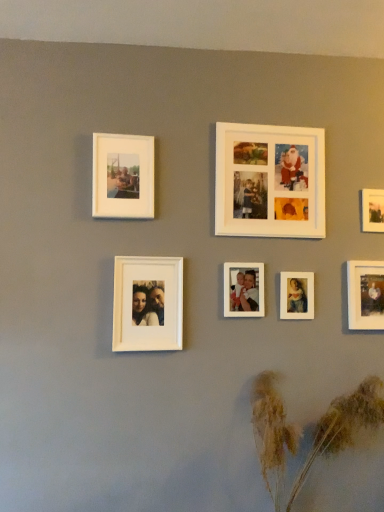
What do you see at coordinates (373, 210) in the screenshot? The image size is (384, 512). I see `matte white photo frame at upper right, marked as the seventh picture frame in a left-to-right arrangement` at bounding box center [373, 210].

What do you see at coordinates (365, 295) in the screenshot? The image size is (384, 512). I see `matte white photo frame at lower right, the 6th picture frame from the left` at bounding box center [365, 295].

Locate an element on the screen. white matte photo frame at center, arranged as the 3th picture frame when viewed from the left is located at coordinates pyautogui.click(x=244, y=290).

How much space does white matte photo frame at upper center, arranged as the fourth picture frame when viewed from the left, occupy horizontally?

white matte photo frame at upper center, arranged as the fourth picture frame when viewed from the left, is 2.12 inches in width.

What is the approximate height of white matte photo frame at upper center, arranged as the fourth picture frame when viewed from the left?

The height of white matte photo frame at upper center, arranged as the fourth picture frame when viewed from the left, is 18.93 inches.

In order to face white matte photo frame at upper left, which ranks as the 7th picture frame in right-to-left order, should I rotate leftwards or rightwards?

Turn left approximately 9.119 degrees to face it.

Image resolution: width=384 pixels, height=512 pixels. What do you see at coordinates (296, 295) in the screenshot?
I see `matte white photo frame at center right, the third picture frame viewed from the right` at bounding box center [296, 295].

This screenshot has width=384, height=512. Identify the location of brown textured plant at lower right. (344, 424).

Identify the location of matte white photo frame at upper right, marked as the seventh picture frame in a left-to-right arrangement. (373, 210).

From the image's perspective, relative to brown textured plant at lower right, is matte white photo frame at lower right, the 6th picture frame from the left, above or below?

Based on their image positions, matte white photo frame at lower right, the 6th picture frame from the left, is located above brown textured plant at lower right.

Considering the points (369, 325) and (269, 419), which point is in front, point (369, 325) or point (269, 419)?

The point (269, 419) is closer to the camera.

Between matte white photo frame at lower right, the 6th picture frame from the left, and brown textured plant at lower right, which one has larger size?

brown textured plant at lower right is bigger.

Is matte white photo frame at lower right, positioned as the second picture frame in right-to-left order, positioned far away from brown textured plant at lower right?

That's not correct — matte white photo frame at lower right, positioned as the second picture frame in right-to-left order, is a little close to brown textured plant at lower right.

How distant is white matte photo frame at center, the sixth picture frame from the right, from matte white photo frame at upper right, marked as the seventh picture frame in a left-to-right arrangement?

white matte photo frame at center, the sixth picture frame from the right, and matte white photo frame at upper right, marked as the seventh picture frame in a left-to-right arrangement, are 35.89 inches apart.

Considering the relative sizes of white matte photo frame at center, the sixth picture frame from the right, and matte white photo frame at upper right, marked as the seventh picture frame in a left-to-right arrangement, in the image provided, is white matte photo frame at center, the sixth picture frame from the right, bigger than matte white photo frame at upper right, marked as the seventh picture frame in a left-to-right arrangement,?

Yes, white matte photo frame at center, the sixth picture frame from the right, is bigger than matte white photo frame at upper right, marked as the seventh picture frame in a left-to-right arrangement.

In the scene shown: Considering the relative sizes of white matte photo frame at center, the sixth picture frame from the right, and matte white photo frame at upper right, marked as the seventh picture frame in a left-to-right arrangement, in the image provided, is white matte photo frame at center, the sixth picture frame from the right, taller than matte white photo frame at upper right, marked as the seventh picture frame in a left-to-right arrangement,?

Yes.

In the image, is white matte photo frame at center, acting as the second picture frame starting from the left, positioned in front of or behind matte white photo frame at upper right, the 1th picture frame from the right?

Visually, white matte photo frame at center, acting as the second picture frame starting from the left, is located in front of matte white photo frame at upper right, the 1th picture frame from the right.

Is brown textured plant at lower right turned away from white matte photo frame at center, the sixth picture frame from the right?

No.

Between brown textured plant at lower right and white matte photo frame at center, the sixth picture frame from the right, which one is positioned behind?

white matte photo frame at center, the sixth picture frame from the right.

Based on the photo, from a real-world perspective, is brown textured plant at lower right positioned under white matte photo frame at center, the sixth picture frame from the right, based on gravity?

Yes, from a real-world perspective, brown textured plant at lower right is under white matte photo frame at center, the sixth picture frame from the right.

How different are the orientations of brown textured plant at lower right and white matte photo frame at center, acting as the second picture frame starting from the left, in degrees?

1.08 degrees separate the facing orientations of brown textured plant at lower right and white matte photo frame at center, acting as the second picture frame starting from the left.

Is matte white photo frame at upper right, the 1th picture frame from the right, situated inside white matte photo frame at center, arranged as the 3th picture frame when viewed from the left, or outside?

→ matte white photo frame at upper right, the 1th picture frame from the right, is located beyond the bounds of white matte photo frame at center, arranged as the 3th picture frame when viewed from the left.

From the image's perspective, would you say matte white photo frame at upper right, marked as the seventh picture frame in a left-to-right arrangement, is shown under white matte photo frame at center, arranged as the 3th picture frame when viewed from the left?

No.

Is matte white photo frame at upper right, the 1th picture frame from the right, placed right next to white matte photo frame at center, placed as the fifth picture frame when sorted from right to left?

matte white photo frame at upper right, the 1th picture frame from the right, and white matte photo frame at center, placed as the fifth picture frame when sorted from right to left, are not in contact.

Between point (374, 200) and point (237, 290), which one is positioned behind?

The point (374, 200) is more distant.

From the image's perspective, would you say matte white photo frame at center right, which is the 5th picture frame in left-to-right order, is positioned over matte white photo frame at upper right, marked as the seventh picture frame in a left-to-right arrangement?

No, from the image's perspective, matte white photo frame at center right, which is the 5th picture frame in left-to-right order, is not on top of matte white photo frame at upper right, marked as the seventh picture frame in a left-to-right arrangement.

What's the angular difference between matte white photo frame at center right, the third picture frame viewed from the right, and matte white photo frame at upper right, marked as the seventh picture frame in a left-to-right arrangement,'s facing directions?

The angle between the facing direction of matte white photo frame at center right, the third picture frame viewed from the right, and the facing direction of matte white photo frame at upper right, marked as the seventh picture frame in a left-to-right arrangement, is 0.054 degrees.

Is matte white photo frame at center right, which is the 5th picture frame in left-to-right order, not near matte white photo frame at upper right, marked as the seventh picture frame in a left-to-right arrangement?

Actually, matte white photo frame at center right, which is the 5th picture frame in left-to-right order, and matte white photo frame at upper right, marked as the seventh picture frame in a left-to-right arrangement, are a little close together.

From a real-world perspective, is matte white photo frame at center right, the third picture frame viewed from the right, over matte white photo frame at upper right, the 1th picture frame from the right?

No, from a real-world perspective, matte white photo frame at center right, the third picture frame viewed from the right, is not over matte white photo frame at upper right, the 1th picture frame from the right

From their relative heights in the image, would you say white matte photo frame at center, arranged as the 3th picture frame when viewed from the left, is taller or shorter than matte white photo frame at center right, the third picture frame viewed from the right?

white matte photo frame at center, arranged as the 3th picture frame when viewed from the left, is taller than matte white photo frame at center right, the third picture frame viewed from the right.

Locate an element on the screen. Image resolution: width=384 pixels, height=512 pixels. the 1st picture frame behind when counting from the white matte photo frame at center, placed as the fifth picture frame when sorted from right to left is located at coordinates (296, 295).

Is point (239, 300) farther from viewer compared to point (308, 272)?

No, it is in front of (308, 272).

Is white matte photo frame at center, placed as the fifth picture frame when sorted from right to left, with matte white photo frame at center right, which is the 5th picture frame in left-to-right order?

There is a gap between white matte photo frame at center, placed as the fifth picture frame when sorted from right to left, and matte white photo frame at center right, which is the 5th picture frame in left-to-right order.

Does white matte photo frame at center, placed as the fifth picture frame when sorted from right to left, touch matte white photo frame at lower right, positioned as the second picture frame in right-to-left order?

No.

Considering the relative sizes of white matte photo frame at center, arranged as the 3th picture frame when viewed from the left, and matte white photo frame at lower right, the 6th picture frame from the left, in the image provided, is white matte photo frame at center, arranged as the 3th picture frame when viewed from the left, thinner than matte white photo frame at lower right, the 6th picture frame from the left,?

No, white matte photo frame at center, arranged as the 3th picture frame when viewed from the left, is not thinner than matte white photo frame at lower right, the 6th picture frame from the left.

Is white matte photo frame at center, placed as the fifth picture frame when sorted from right to left, situated inside matte white photo frame at lower right, the 6th picture frame from the left, or outside?

white matte photo frame at center, placed as the fifth picture frame when sorted from right to left, cannot be found inside matte white photo frame at lower right, the 6th picture frame from the left.

From the picture: Is white matte photo frame at center, placed as the fifth picture frame when sorted from right to left, aimed at matte white photo frame at lower right, positioned as the second picture frame in right-to-left order?

No.

Locate an element on the screen. the 1st picture frame counting from the right side of the brown textured plant at lower right is located at coordinates (365, 295).

From the white matte photo frame at center, the sixth picture frame from the right, count 6th picture frames backward and point to it. Please provide its 2D coordinates.

[(373, 210)]

When comparing their distances from matte white photo frame at upper right, marked as the seventh picture frame in a left-to-right arrangement, does white matte photo frame at center, acting as the second picture frame starting from the left, or matte white photo frame at lower right, positioned as the second picture frame in right-to-left order, seem further?

Based on the image, white matte photo frame at center, acting as the second picture frame starting from the left, appears to be further to matte white photo frame at upper right, marked as the seventh picture frame in a left-to-right arrangement.

Considering their positions, is white matte photo frame at upper center, arranged as the fourth picture frame when viewed from the right, positioned closer to white matte photo frame at center, placed as the fifth picture frame when sorted from right to left, than white matte photo frame at center, acting as the second picture frame starting from the left?

white matte photo frame at center, acting as the second picture frame starting from the left, lies closer to white matte photo frame at center, placed as the fifth picture frame when sorted from right to left, than the other object.

Estimate the real-world distances between objects in this image. Which object is further from white matte photo frame at upper left, the first picture frame positioned from the left, brown textured plant at lower right or white matte photo frame at upper center, arranged as the fourth picture frame when viewed from the right?

brown textured plant at lower right is further to white matte photo frame at upper left, the first picture frame positioned from the left.

Based on their spatial positions, is white matte photo frame at center, acting as the second picture frame starting from the left, or matte white photo frame at upper right, marked as the seventh picture frame in a left-to-right arrangement, further from brown textured plant at lower right?

Based on the image, matte white photo frame at upper right, marked as the seventh picture frame in a left-to-right arrangement, appears to be further to brown textured plant at lower right.

Looking at the image, which one is located closer to white matte photo frame at center, arranged as the 3th picture frame when viewed from the left, white matte photo frame at upper left, the first picture frame positioned from the left, or matte white photo frame at upper right, marked as the seventh picture frame in a left-to-right arrangement?

The object closer to white matte photo frame at center, arranged as the 3th picture frame when viewed from the left, is white matte photo frame at upper left, the first picture frame positioned from the left.

Looking at the image, which one is located closer to matte white photo frame at center right, the third picture frame viewed from the right, white matte photo frame at center, acting as the second picture frame starting from the left, or white matte photo frame at upper center, arranged as the fourth picture frame when viewed from the right?

Among the two, white matte photo frame at upper center, arranged as the fourth picture frame when viewed from the right, is located nearer to matte white photo frame at center right, the third picture frame viewed from the right.

Estimate the real-world distances between objects in this image. Which object is further from matte white photo frame at upper right, marked as the seventh picture frame in a left-to-right arrangement, white matte photo frame at center, arranged as the 3th picture frame when viewed from the left, or white matte photo frame at upper center, arranged as the fourth picture frame when viewed from the left?

Among the two, white matte photo frame at center, arranged as the 3th picture frame when viewed from the left, is located further to matte white photo frame at upper right, marked as the seventh picture frame in a left-to-right arrangement.

Which object lies nearer to the anchor point matte white photo frame at center right, the third picture frame viewed from the right, white matte photo frame at center, arranged as the 3th picture frame when viewed from the left, or brown textured plant at lower right?

Among the two, white matte photo frame at center, arranged as the 3th picture frame when viewed from the left, is located nearer to matte white photo frame at center right, the third picture frame viewed from the right.

Locate an element on the screen. plant situated between white matte photo frame at upper left, the first picture frame positioned from the left, and matte white photo frame at lower right, the 6th picture frame from the left, from left to right is located at coordinates (344, 424).

Where is `plant between white matte photo frame at center, acting as the second picture frame starting from the left, and matte white photo frame at upper right, marked as the seventh picture frame in a left-to-right arrangement`? plant between white matte photo frame at center, acting as the second picture frame starting from the left, and matte white photo frame at upper right, marked as the seventh picture frame in a left-to-right arrangement is located at coordinates (344, 424).

Find the location of a particular element. Image resolution: width=384 pixels, height=512 pixels. picture frame between matte white photo frame at center right, the third picture frame viewed from the right, and matte white photo frame at upper right, the 1th picture frame from the right, from left to right is located at coordinates (365, 295).

Where is `plant between white matte photo frame at center, the sixth picture frame from the right, and matte white photo frame at lower right, the 6th picture frame from the left`? plant between white matte photo frame at center, the sixth picture frame from the right, and matte white photo frame at lower right, the 6th picture frame from the left is located at coordinates (344, 424).